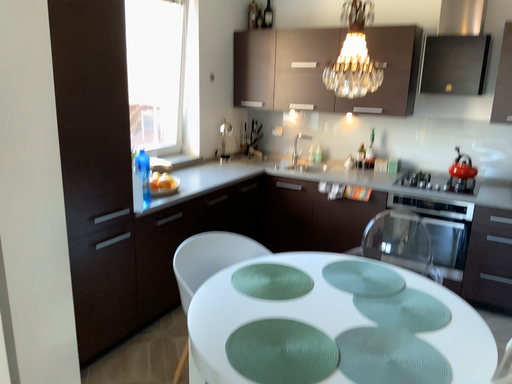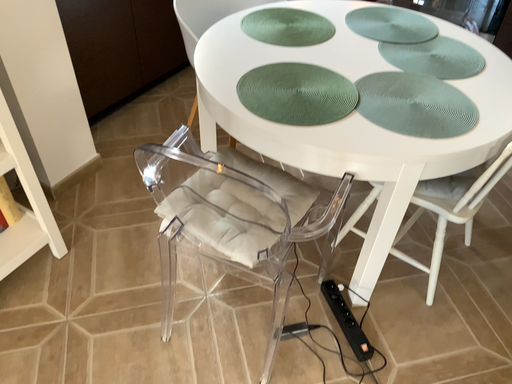
Question: Which way did the camera rotate in the video?

Choices:
 (A) rotated upward
 (B) rotated downward

Answer: (B)